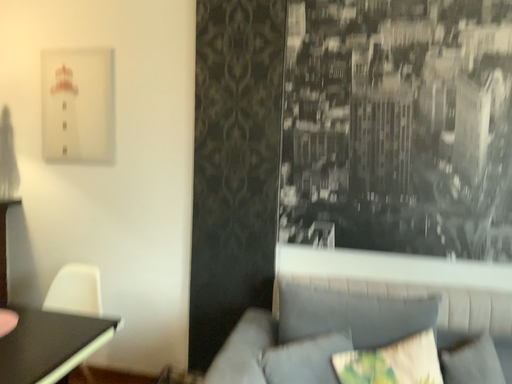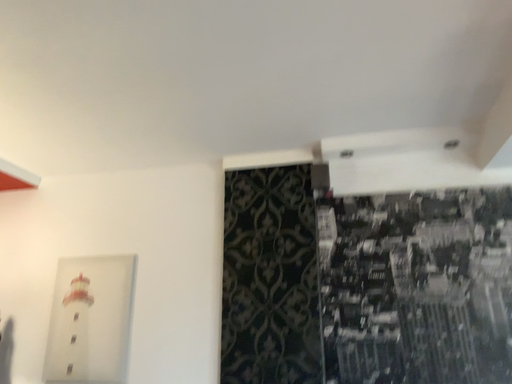
Question: How did the camera likely rotate when shooting the video?

Choices:
 (A) rotated downward
 (B) rotated upward

Answer: (B)